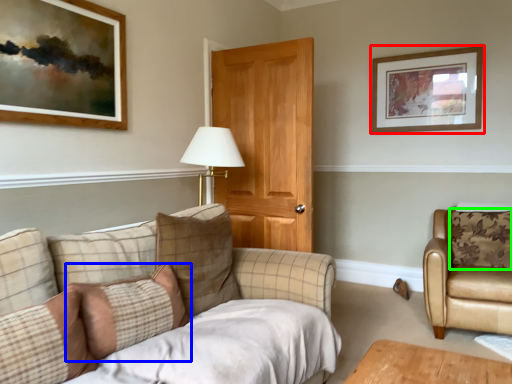
Question: Which object is positioned farthest from picture frame (highlighted by a red box)? Select from pillow (highlighted by a blue box) and pillow (highlighted by a green box).

Choices:
 (A) pillow
 (B) pillow

Answer: (A)